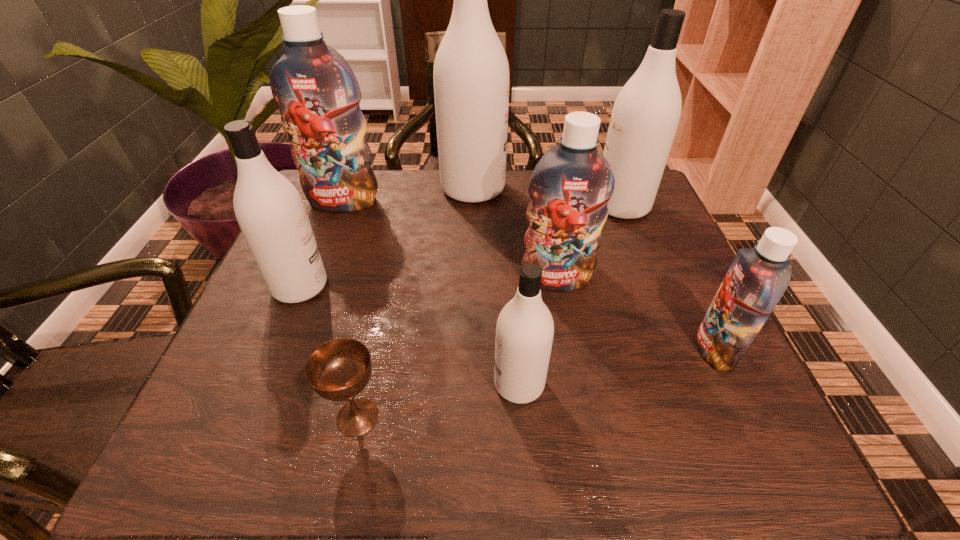
You are a GUI agent. You are given a task and a screenshot of the screen. Output one action in this format:
    pyautogui.click(x=<x>, y=<y>)
    Task: Click on the free space located 0.350m on the front label of the second blue shampoo from right to left
    The width and height of the screenshot is (960, 540).
    Given the screenshot: What is the action you would take?
    pyautogui.click(x=588, y=459)

Where is `vacant space situated 0.270m on the front label of the rightmost blue shampoo`? Image resolution: width=960 pixels, height=540 pixels. vacant space situated 0.270m on the front label of the rightmost blue shampoo is located at coordinates (551, 350).

Locate an element on the screen. free space located on the front label of the rightmost blue shampoo is located at coordinates (600, 350).

Identify the location of free spot located on the front label of the rightmost blue shampoo. The width and height of the screenshot is (960, 540). (633, 350).

What are the coordinates of `free space located on the front-facing side of the smallest white shampoo` in the screenshot? It's located at (286, 384).

Where is `vacant space situated 0.390m on the front-facing side of the smallest white shampoo`? This screenshot has width=960, height=540. vacant space situated 0.390m on the front-facing side of the smallest white shampoo is located at coordinates (269, 384).

Identify the location of blank space located on the front-facing side of the smallest white shampoo. The width and height of the screenshot is (960, 540). (424, 384).

You are a GUI agent. You are given a task and a screenshot of the screen. Output one action in this format:
    pyautogui.click(x=<x>, y=<y>)
    Task: Click on the vacant space positioned 0.280m on the back of the chalice
    The width and height of the screenshot is (960, 540).
    Given the screenshot: What is the action you would take?
    pyautogui.click(x=388, y=279)

This screenshot has height=540, width=960. Find the location of `object positioned at the near edge`. object positioned at the near edge is located at coordinates (338, 370).

Where is `object that is at the far left corner`? Image resolution: width=960 pixels, height=540 pixels. object that is at the far left corner is located at coordinates (318, 95).